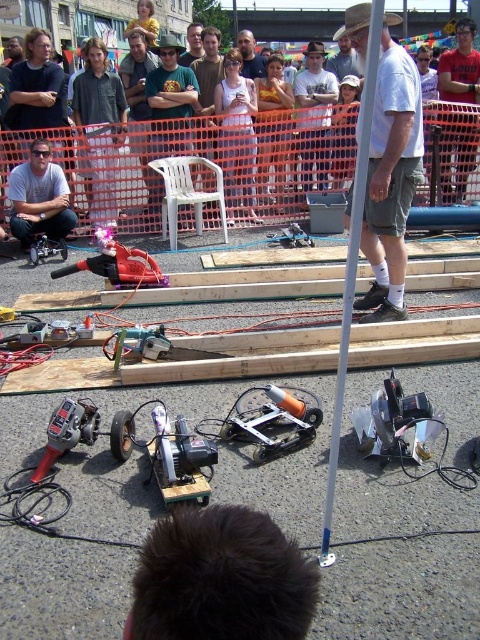
Question: Can you confirm if white cotton shirt at center is positioned to the right of matte black shirt at left?

Choices:
 (A) no
 (B) yes

Answer: (B)

Question: Which of the following is the closest to the observer?

Choices:
 (A) white cotton shirt at center
 (B) metallic silver robot at center
 (C) matte black shirt at left
 (D) metallic silver circular saw at lower right

Answer: (D)

Question: Which point is farther to the camera?

Choices:
 (A) (412, 401)
 (B) (39, 170)
 (C) (286, 387)

Answer: (B)

Question: Which point is closer to the camera taking this photo?

Choices:
 (A) (264, 429)
 (B) (196, 49)
 (C) (242, 36)

Answer: (A)

Question: Observing the image, what is the correct spatial positioning of white cotton shirt at center in reference to matte black shirt at left?

Choices:
 (A) above
 (B) below

Answer: (B)

Question: Can you confirm if white plastic pole at center is smaller than matte black shirt at center?

Choices:
 (A) yes
 (B) no

Answer: (A)